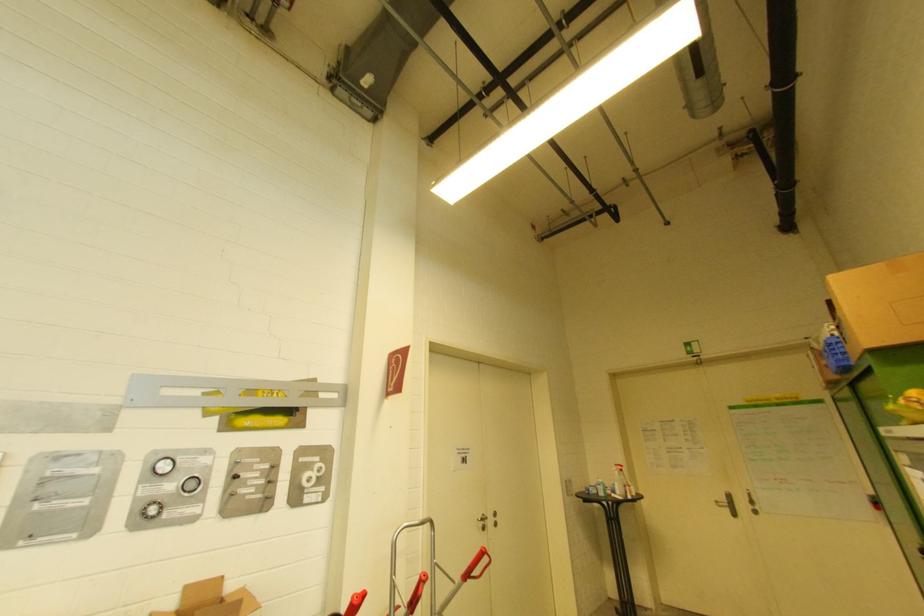
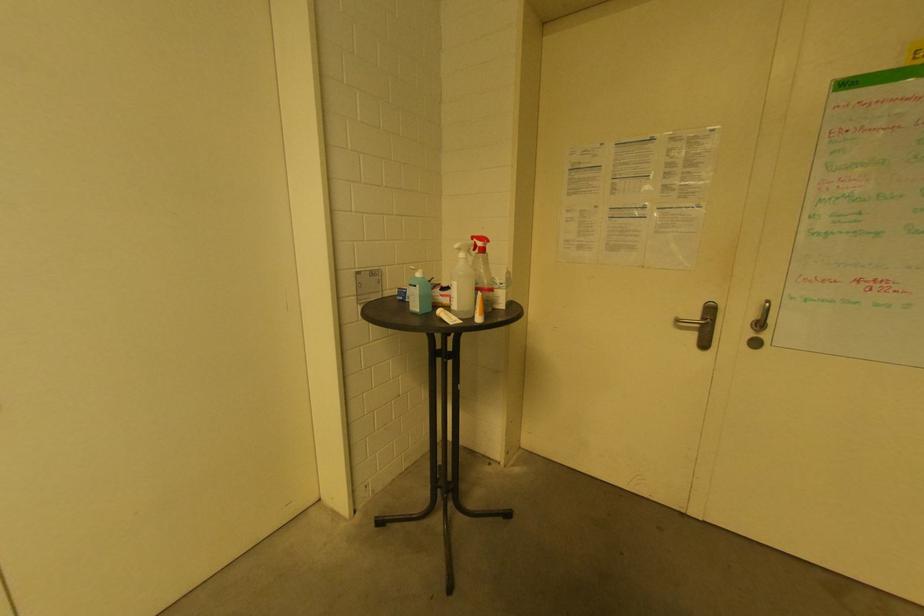
Find the pixel in the second image that matches point 618,474 in the first image.

(464, 256)